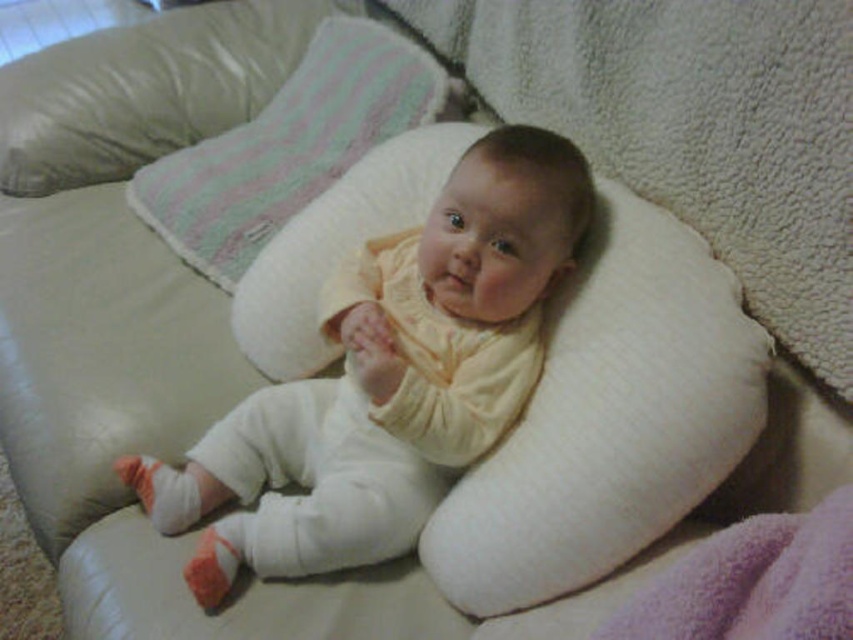
You are a parent trying to place a small toy on the purple soft blanket at lower right. Can you place the toy directly on the blanket without it touching the white soft pillow at center?

The white soft pillow at center is positioned over the purple soft blanket at lower right, so placing the toy directly on the blanket would require placing it under the pillow. Since the pillow is on top, the toy might touch it unless placed carefully around or beside the pillow.

You are a parent trying to arrange two pillows for your baby. You have a white fleece pillow at center and a white soft pillow at center. According to the image, which pillow should you place on top to match the arrangement?

The white fleece pillow at center should be placed on top of the white soft pillow at center to match the arrangement shown in the image.